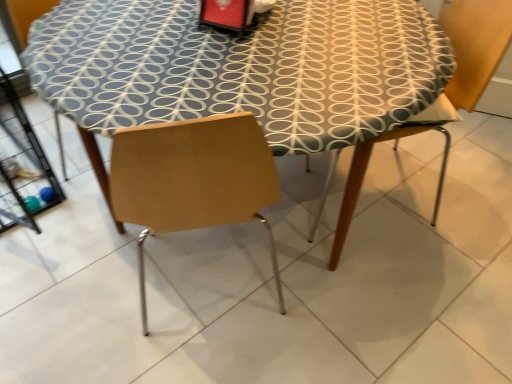
You are a GUI agent. You are given a task and a screenshot of the screen. Output one action in this format:
    pyautogui.click(x=<x>, y=<y>)
    Task: Click on the vacant space in front of wooden chair at right
    
    Given the screenshot: What is the action you would take?
    pyautogui.click(x=417, y=290)